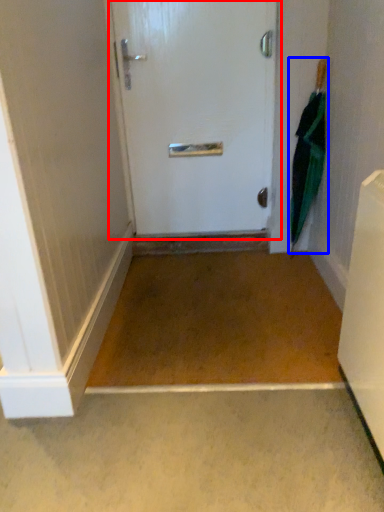
Question: Which of the following is the farthest to the observer, door (highlighted by a red box) or umbrella (highlighted by a blue box)?

Choices:
 (A) door
 (B) umbrella

Answer: (A)